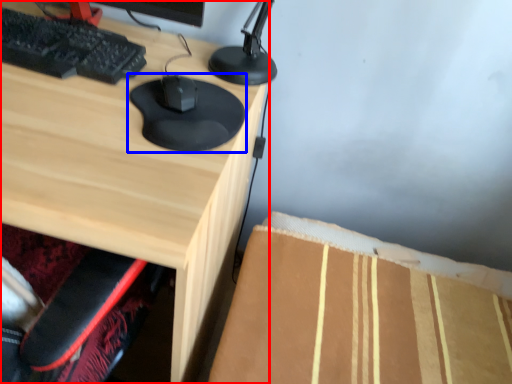
Question: Which object is further to the camera taking this photo, desk (highlighted by a red box) or mouse (highlighted by a blue box)?

Choices:
 (A) desk
 (B) mouse

Answer: (B)